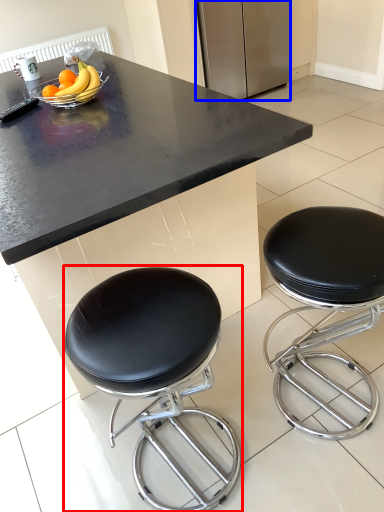
Question: Which of the following is the farthest to the observer, stool (highlighted by a red box) or appliance (highlighted by a blue box)?

Choices:
 (A) stool
 (B) appliance

Answer: (B)